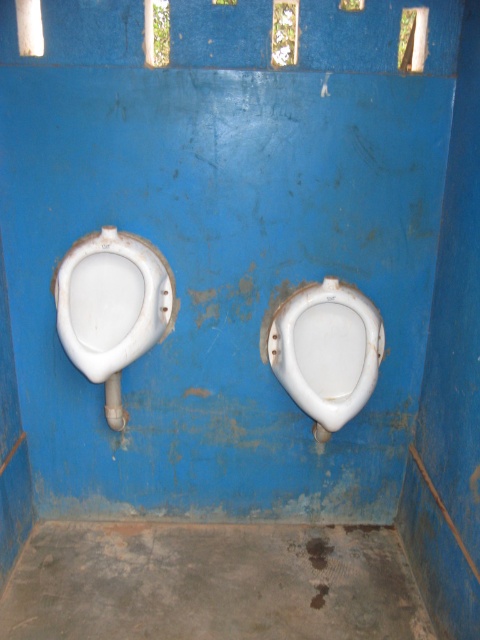
You are standing in the restroom and want to reach the point at coordinates point (100,292). Considering the restroom layout described, can you estimate how far you need to walk to get there?

The point (100,292) is 2.22 meters from the camera, so you need to walk approximately 2.22 meters to reach it.

Based on the photo, you are a maintenance worker in a public restroom. You need to locate the urinal at the specified coordinate point. Which urinal is at point (111,307)?

The white glossy urinal at left is located at point (111,307).

You are a maintenance worker needing to clean the restroom. You have a 24 inch mop that can extend to 30 inches. Can you reach from the white glossy urinal at left to the white glossy toilet bowl at center with your mop?

The distance between the white glossy urinal at left and the white glossy toilet bowl at center is 24.52 inches. Since the mop can extend up to 30 inches, it is within the mop length range. Therefore, you can reach from the white glossy urinal at left to the white glossy toilet bowl at center with your mop.